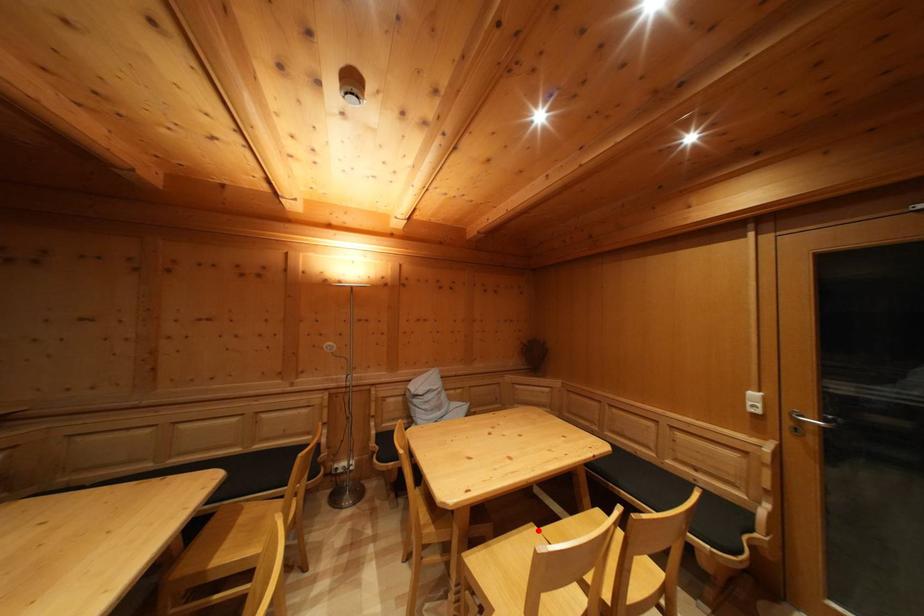
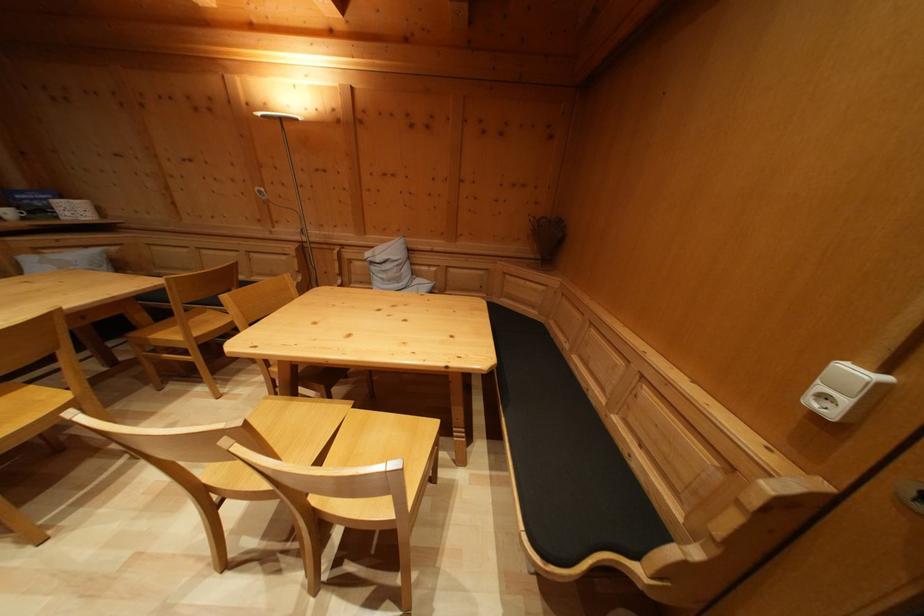
Locate, in the second image, the point that corresponds to the highlighted location in the first image.

(359, 408)